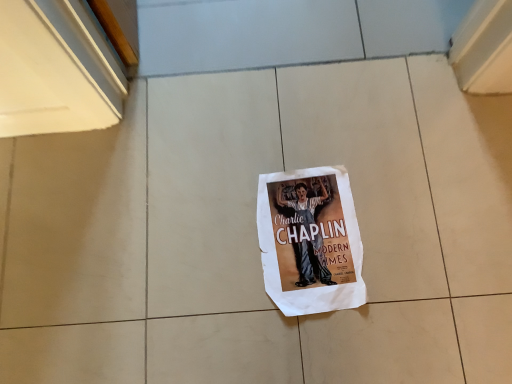
Locate an element on the screen. This screenshot has height=384, width=512. vacant area situated to the left side of white paper poster at center is located at coordinates (202, 228).